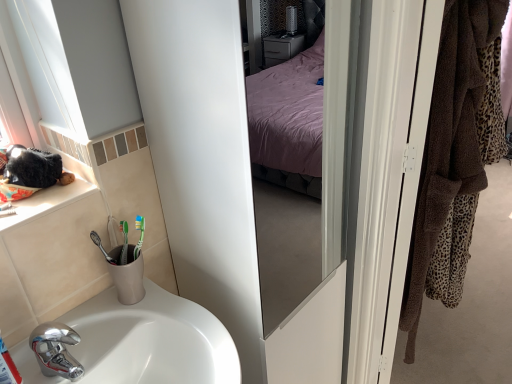
Question: Could white glossy sink at lower left be considered to be inside brown towel at right?

Choices:
 (A) no
 (B) yes

Answer: (A)

Question: Is brown towel at right oriented towards white glossy sink at lower left?

Choices:
 (A) no
 (B) yes

Answer: (A)

Question: Is brown towel at right closer to the viewer compared to white glossy sink at lower left?

Choices:
 (A) yes
 (B) no

Answer: (B)

Question: Is brown towel at right touching white glossy sink at lower left?

Choices:
 (A) no
 (B) yes

Answer: (A)

Question: From a real-world perspective, is brown towel at right located higher than white glossy sink at lower left?

Choices:
 (A) yes
 (B) no

Answer: (A)

Question: Visually, is white ceramic window sill at left positioned to the left or to the right of white glossy sink at lower left?

Choices:
 (A) left
 (B) right

Answer: (A)

Question: From a real-world perspective, is white ceramic window sill at left positioned above or below white glossy sink at lower left?

Choices:
 (A) below
 (B) above

Answer: (B)

Question: Considering their positions, is white ceramic window sill at left located in front of or behind white glossy sink at lower left?

Choices:
 (A) front
 (B) behind

Answer: (B)

Question: Looking at their shapes, would you say white ceramic window sill at left is wider or thinner than white glossy sink at lower left?

Choices:
 (A) thin
 (B) wide

Answer: (A)

Question: From a real-world perspective, is white glossy screen door at right physically located above or below brown towel at right?

Choices:
 (A) above
 (B) below

Answer: (B)

Question: In the image, is white glossy screen door at right positioned in front of or behind brown towel at right?

Choices:
 (A) front
 (B) behind

Answer: (A)

Question: From the image's perspective, is white glossy screen door at right positioned above or below brown towel at right?

Choices:
 (A) below
 (B) above

Answer: (A)

Question: Is white glossy screen door at right bigger or smaller than brown towel at right?

Choices:
 (A) small
 (B) big

Answer: (A)

Question: In terms of height, does brown towel at right look taller or shorter compared to white ceramic window sill at left?

Choices:
 (A) short
 (B) tall

Answer: (B)

Question: Considering the positions of brown towel at right and white ceramic window sill at left in the image, is brown towel at right wider or thinner than white ceramic window sill at left?

Choices:
 (A) wide
 (B) thin

Answer: (A)